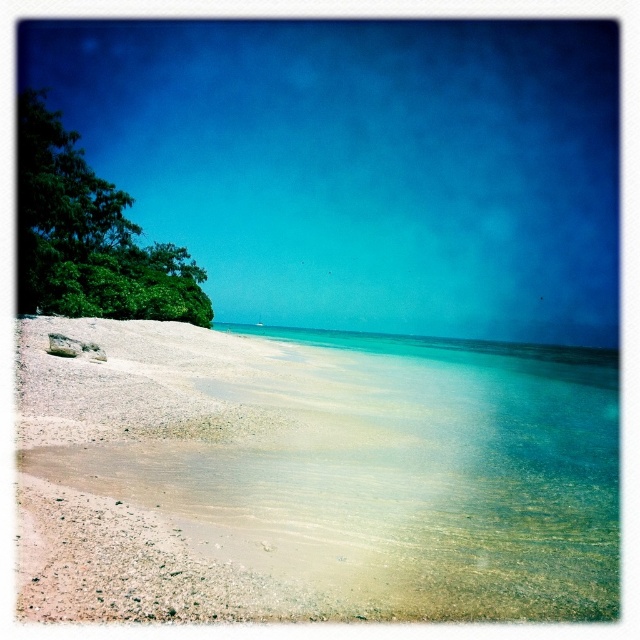
You are standing at the center of the image and want to walk to the sandy beach at lower left. Which direction should you move?

You should move to the lower left direction to reach the sandy beach at lower left.

You are standing on the sandy beach at lower left and want to walk to the green leafy tree at left. Which direction should you head towards?

The sandy beach at lower left is in front of the green leafy tree at left, so you should walk towards the left direction to reach the green leafy tree at left.

You are standing on the sandy beach at lower left and want to walk towards the green leafy tree at left. Which direction should you face to move towards it?

You should face to the left because the sandy beach at lower left is to the right of the green leafy tree at left, meaning the tree is located to your left side.